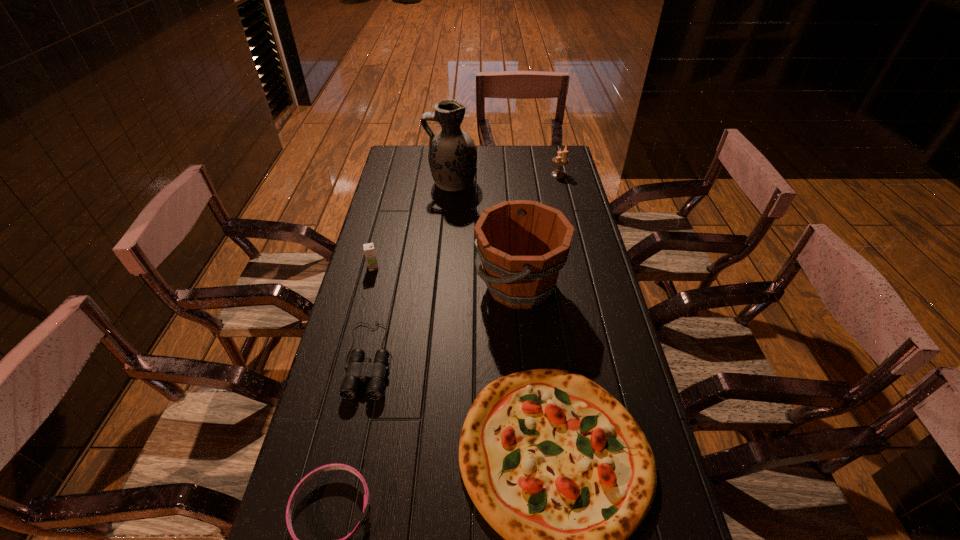
Find the location of a particular element. The height and width of the screenshot is (540, 960). free spot located 0.150m on the handle side of the sixth shortest object is located at coordinates (x=427, y=286).

Locate an element on the screen. vacant area situated 0.190m on the front of the third tallest object is located at coordinates (566, 205).

Locate an element on the screen. The height and width of the screenshot is (540, 960). vacant space located 0.360m on the back of the fourth tallest object is located at coordinates (390, 202).

Identify the location of blank area located at the eyepiece of the binoculars. (341, 488).

The height and width of the screenshot is (540, 960). I want to click on vase present at the far edge, so click(x=452, y=156).

I want to click on candle holder that is at the far edge, so click(559, 160).

Find the location of a particular element. The height and width of the screenshot is (540, 960). chocolate milk located in the left edge section of the desktop is located at coordinates (369, 251).

Locate an element on the screen. The width and height of the screenshot is (960, 540). binoculars present at the left edge is located at coordinates (359, 368).

Image resolution: width=960 pixels, height=540 pixels. I want to click on bucket that is positioned at the right edge, so click(x=522, y=244).

Identify the location of candle holder at the right edge. (559, 160).